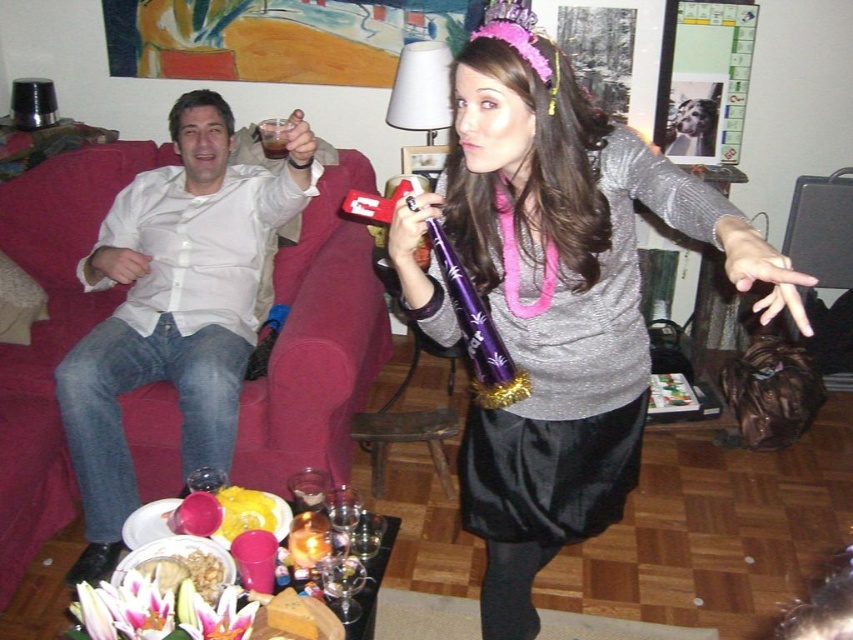
Who is shorter, white button-down shirt at center or satin black dress at center?

satin black dress at center is shorter.

This screenshot has height=640, width=853. I want to click on white button-down shirt at center, so click(173, 308).

Is point (117, 451) farther from viewer compared to point (424, 209)?

Yes, point (117, 451) is farther from viewer.

At what (x,y) coordinates should I click in order to perform the action: click on white button-down shirt at center. Please return your answer as a coordinate pair (x, y). This screenshot has width=853, height=640. Looking at the image, I should click on (173, 308).

Is white button-down shirt at center positioned before brown liquid at couch left?

Yes, it is.

Does white button-down shirt at center have a lesser height compared to brown liquid at couch left?

No, white button-down shirt at center is not shorter than brown liquid at couch left.

Does point (140, 177) come farther from viewer compared to point (257, 125)?

That is False.

The height and width of the screenshot is (640, 853). I want to click on white button-down shirt at center, so click(173, 308).

Is satin black dress at center bigger than brown liquid at couch left?

Indeed, satin black dress at center has a larger size compared to brown liquid at couch left.

Describe the element at coordinates (605, 291) in the screenshot. I see `satin black dress at center` at that location.

Locate an element on the screen. This screenshot has width=853, height=640. satin black dress at center is located at coordinates (605, 291).